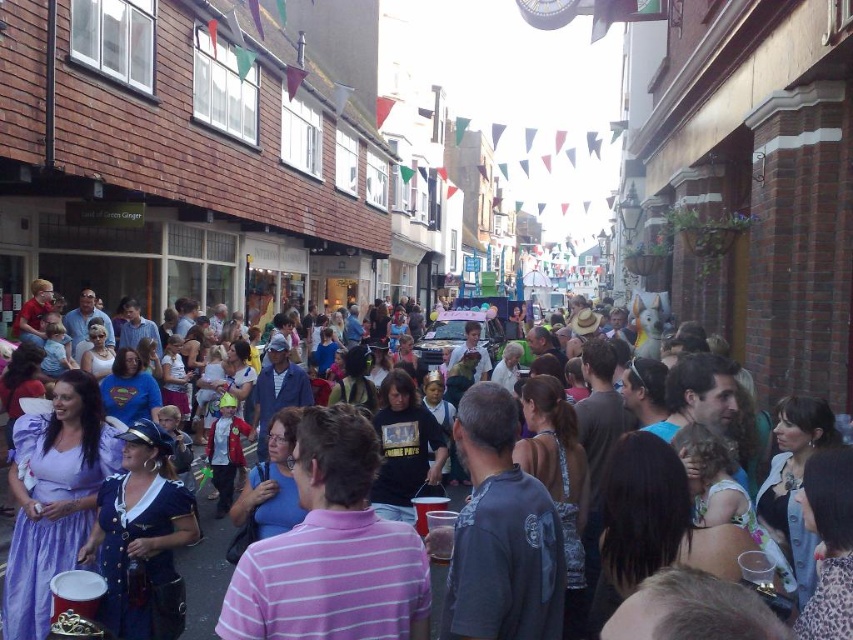
You are standing on the street and want to walk towards both the point at coordinates point (260, 604) and the point at coordinates point (209, 573). Which point will you reach first?

You will reach point (260, 604) first because it is closer to you than point (209, 573).

You are a photographer trying to capture the pink striped shirt at center and the matte plastic cup at center in the same frame. Since both are at the center, can you see both clearly in your photo?

The pink striped shirt at center is positioned over the matte plastic cup at center, so the cup might be partially or fully obscured by the shirt in the photo.